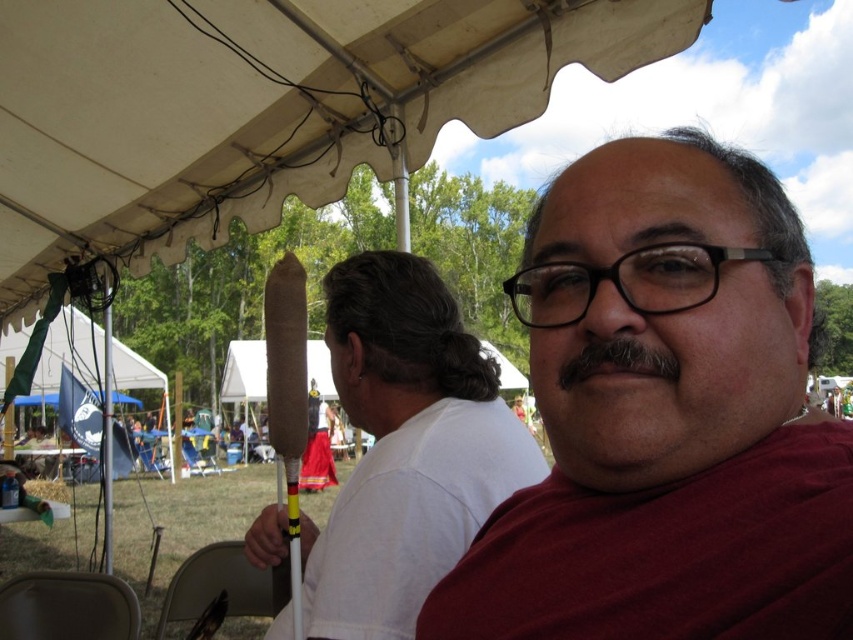
Is maroon fabric shirt at center wider than gray fuzzy mustache at center?

Yes, maroon fabric shirt at center is wider than gray fuzzy mustache at center.

Does point (653, 154) lie in front of point (634, 346)?

That is False.

Find the location of `maroon fabric shirt at center`. maroon fabric shirt at center is located at coordinates (666, 419).

Does point (846, 422) come in front of point (496, 385)?

That is True.

Is maroon fabric shirt at center wider than brown paper cone at center?

No, maroon fabric shirt at center is not wider than brown paper cone at center.

At what (x,y) coordinates should I click in order to perform the action: click on maroon fabric shirt at center. Please return your answer as a coordinate pair (x, y). Looking at the image, I should click on (666, 419).

Between maroon fabric shirt at center and white fabric canopy at upper center, which one is positioned higher?

white fabric canopy at upper center is higher up.

What do you see at coordinates (666, 419) in the screenshot? This screenshot has height=640, width=853. I see `maroon fabric shirt at center` at bounding box center [666, 419].

The width and height of the screenshot is (853, 640). I want to click on maroon fabric shirt at center, so click(666, 419).